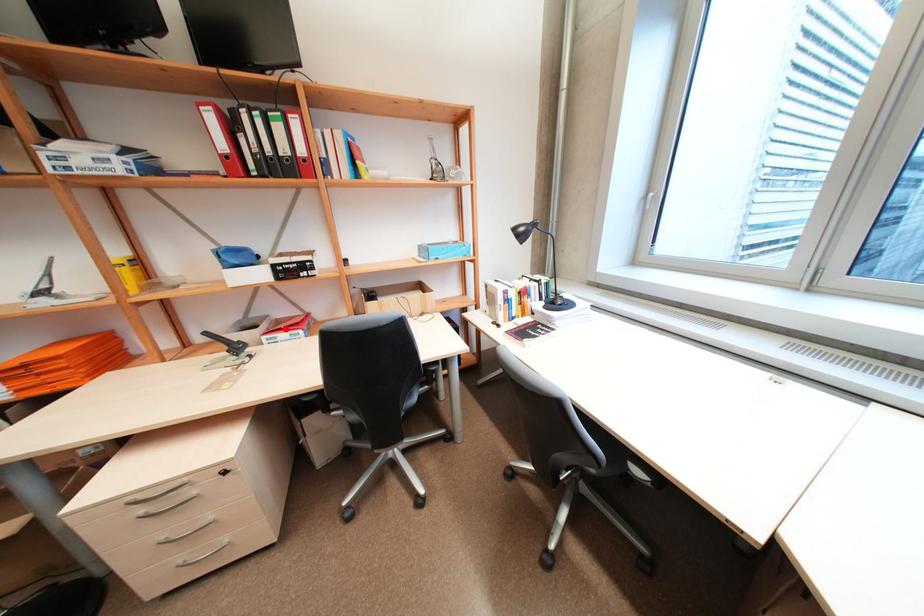
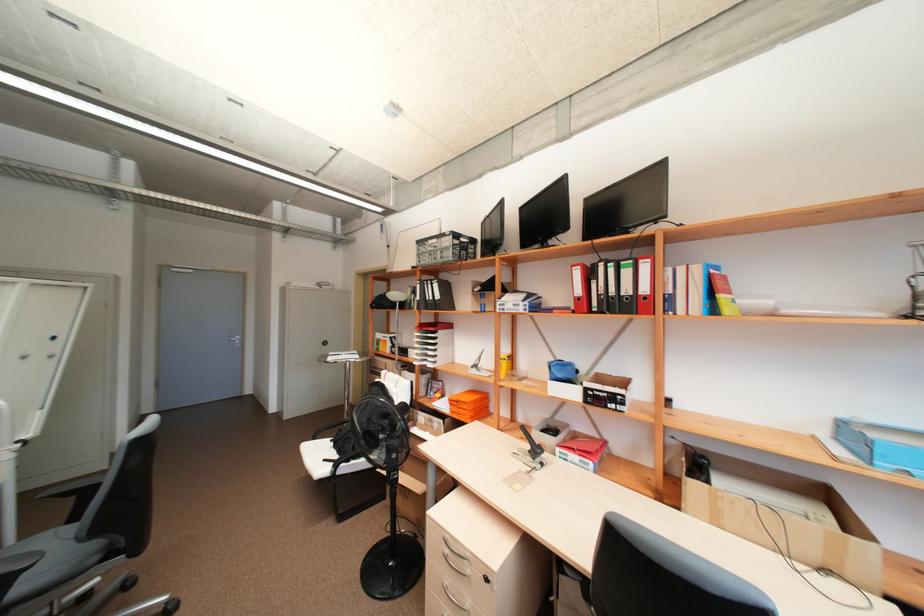
The point at the highlighted location is marked in the first image. Where is the corresponding point in the second image?

(578, 448)